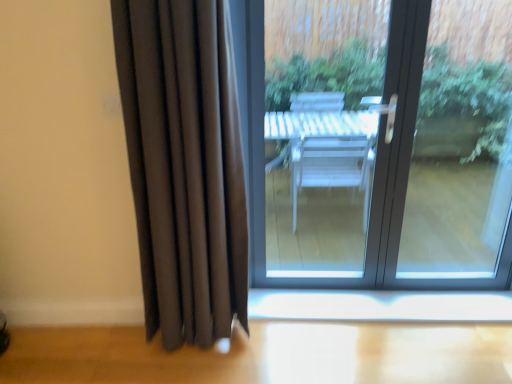
Identify the location of free region under matte black curtain at left (from a real-world perspective). (185, 344).